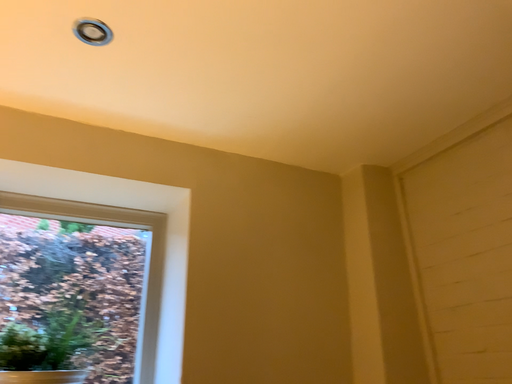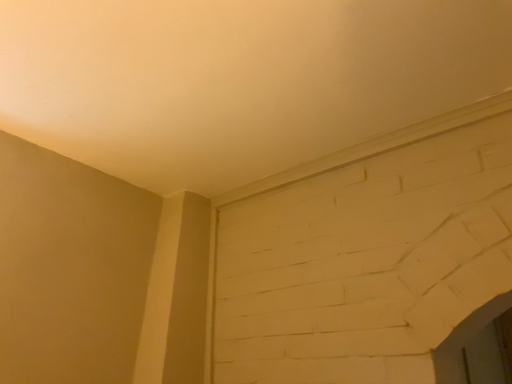
Question: Which way did the camera rotate in the video?

Choices:
 (A) rotated right
 (B) rotated left

Answer: (A)